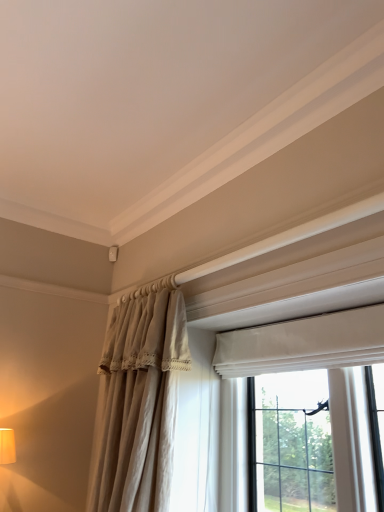
What do you see at coordinates (140, 399) in the screenshot?
I see `beige fabric curtain at upper center` at bounding box center [140, 399].

At what (x,y) coordinates should I click in order to perform the action: click on beige fabric curtain at upper center. Please return your answer as a coordinate pair (x, y). Looking at the image, I should click on (140, 399).

Find the location of a particular element. The height and width of the screenshot is (512, 384). beige fabric curtain at upper center is located at coordinates (140, 399).